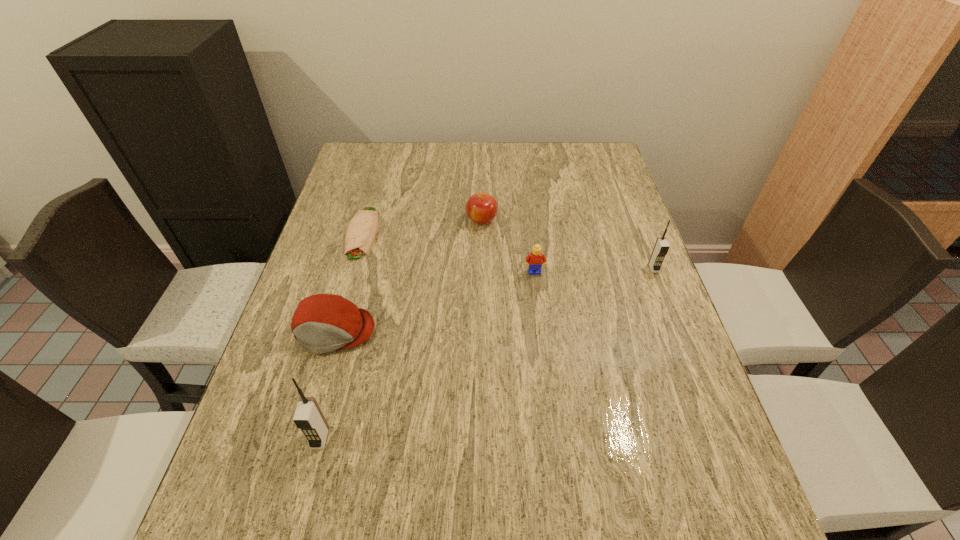
The image size is (960, 540). What are the coordinates of `free spot located at the bitten end of the burrito` in the screenshot? It's located at (321, 381).

Find the location of a particular element. Image resolution: width=960 pixels, height=540 pixels. vacant space located 0.060m on the front-facing side of the second nearest object is located at coordinates (321, 381).

Where is `object positioned at the near edge`? object positioned at the near edge is located at coordinates (308, 417).

You are a GUI agent. You are given a task and a screenshot of the screen. Output one action in this format:
    pyautogui.click(x=<x>, y=<y>)
    Task: Click on the cellular telephone that is at the left edge
    The width and height of the screenshot is (960, 540).
    Given the screenshot: What is the action you would take?
    pyautogui.click(x=308, y=417)

Where is `burrito positioned at the left edge`? The image size is (960, 540). burrito positioned at the left edge is located at coordinates pyautogui.click(x=360, y=234).

Locate an element on the screen. cap at the left edge is located at coordinates (323, 322).

At what (x,y) coordinates should I click in order to perform the action: click on object present at the right edge. Please return your answer as a coordinate pair (x, y). Looking at the image, I should click on (661, 248).

Identify the location of object located in the near left corner section of the desktop. The height and width of the screenshot is (540, 960). (308, 417).

Where is `free space at the far edge`? free space at the far edge is located at coordinates (425, 170).

This screenshot has height=540, width=960. I want to click on vacant region at the near edge of the desktop, so click(562, 464).